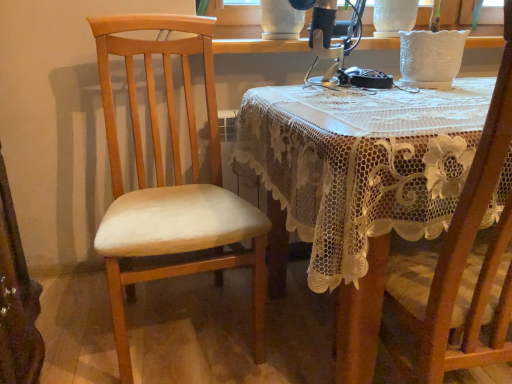
Question: Should I look upward or downward to see white textured vase at upper center?

Choices:
 (A) up
 (B) down

Answer: (A)

Question: Can you confirm if white textured vase at upper center is wider than metallic silver sewing machine at upper center?

Choices:
 (A) no
 (B) yes

Answer: (A)

Question: Considering the relative sizes of white textured vase at upper center and metallic silver sewing machine at upper center in the image provided, is white textured vase at upper center bigger than metallic silver sewing machine at upper center?

Choices:
 (A) no
 (B) yes

Answer: (B)

Question: Is white textured vase at upper center far away from metallic silver sewing machine at upper center?

Choices:
 (A) yes
 (B) no

Answer: (B)

Question: Does white textured vase at upper center come behind metallic silver sewing machine at upper center?

Choices:
 (A) no
 (B) yes

Answer: (B)

Question: Can you confirm if white textured vase at upper center is smaller than metallic silver sewing machine at upper center?

Choices:
 (A) yes
 (B) no

Answer: (B)

Question: Is white textured vase at upper center at the right side of metallic silver sewing machine at upper center?

Choices:
 (A) yes
 (B) no

Answer: (A)

Question: Considering the relative sizes of lacy fabric table at center and white textured vase at upper center in the image provided, is lacy fabric table at center taller than white textured vase at upper center?

Choices:
 (A) no
 (B) yes

Answer: (B)

Question: Are lacy fabric table at center and white textured vase at upper center far apart?

Choices:
 (A) no
 (B) yes

Answer: (B)

Question: Considering the relative sizes of lacy fabric table at center and white textured vase at upper center in the image provided, is lacy fabric table at center wider than white textured vase at upper center?

Choices:
 (A) yes
 (B) no

Answer: (A)

Question: Considering the relative positions of lacy fabric table at center and white textured vase at upper center in the image provided, is lacy fabric table at center to the left of white textured vase at upper center from the viewer's perspective?

Choices:
 (A) yes
 (B) no

Answer: (B)

Question: Considering the relative positions of lacy fabric table at center and white textured vase at upper center in the image provided, is lacy fabric table at center behind white textured vase at upper center?

Choices:
 (A) yes
 (B) no

Answer: (B)

Question: Can you confirm if lacy fabric table at center is bigger than white textured vase at upper center?

Choices:
 (A) no
 (B) yes

Answer: (B)

Question: Can you confirm if lacy fabric table at center is thinner than metallic silver sewing machine at upper center?

Choices:
 (A) yes
 (B) no

Answer: (B)